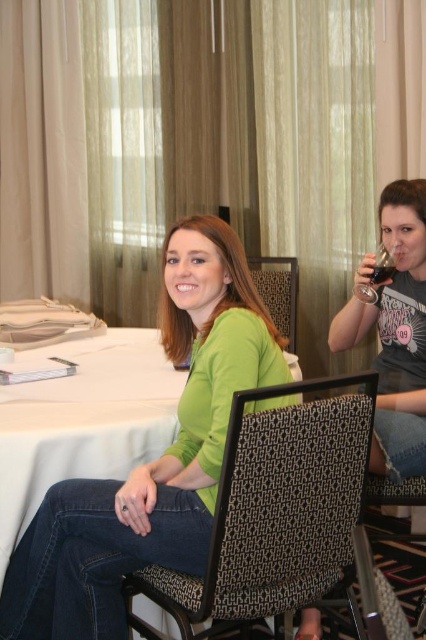
You are a photographer setting up for a group photo in this conference room. You need to ensure that both the green matte shirt at center and the translucent glass wine glass at upper right are clearly visible in the shot. Considering their sizes, which object should you focus on first to ensure proper depth of field?

The green matte shirt at center is taller than the translucent glass wine glass at upper right. Since larger objects typically require more focus to maintain sharpness, you should focus on the green matte shirt at center first to ensure proper depth of field.

You are trying to locate the black textured chair at center in the image. According to the coordinates provided, where would you look?

The black textured chair at center is located at coordinates point (278, 292).

You are standing in the conference room and notice the matte black shirt at right and the translucent glass at upper right. Which object is taller?

The matte black shirt at right is taller than the translucent glass at upper right.